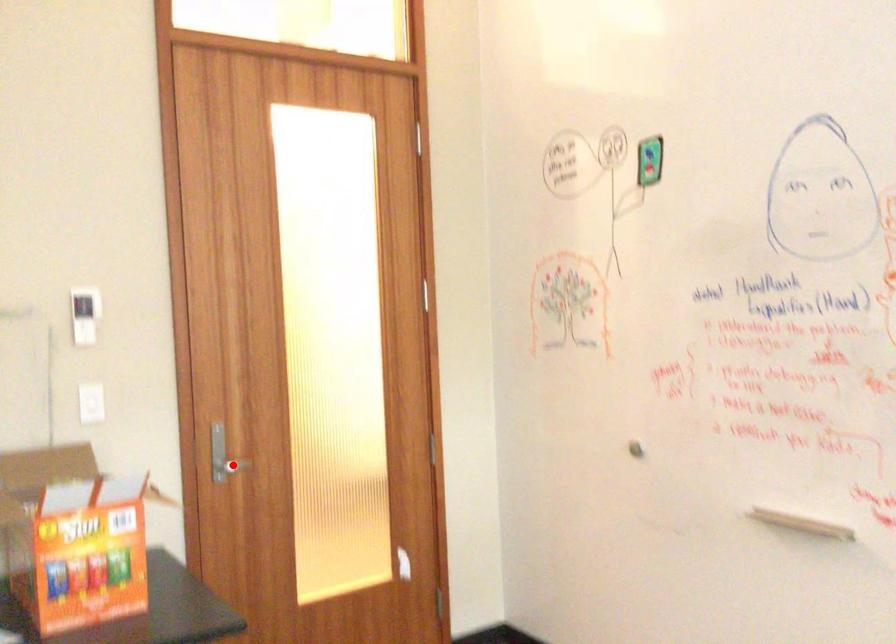
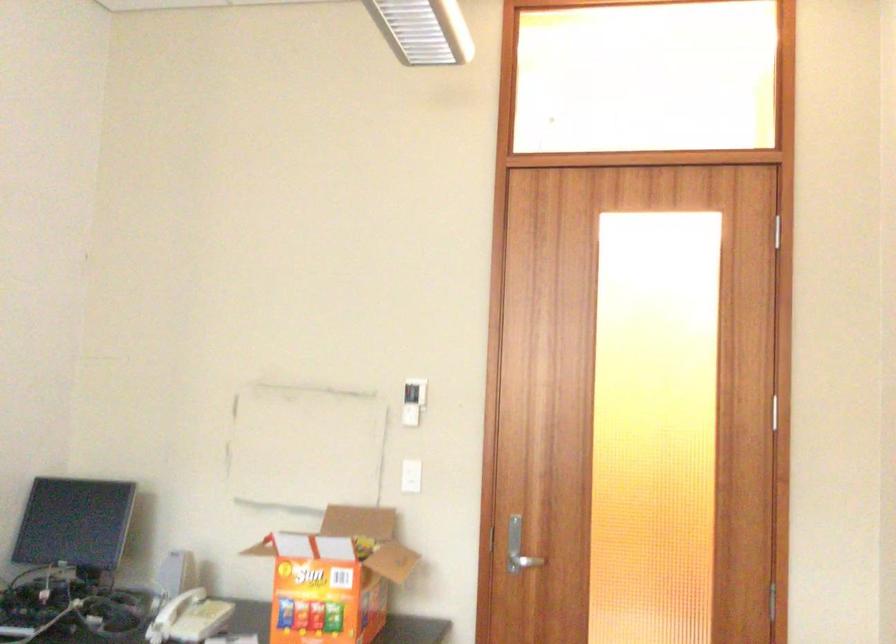
The point at the highlighted location is marked in the first image. Where is the corresponding point in the second image?

(523, 562)